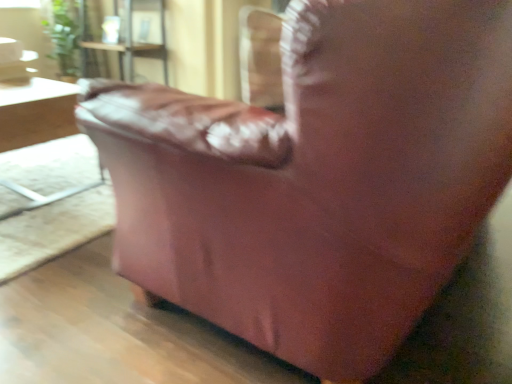
The image size is (512, 384). What do you see at coordinates (36, 112) in the screenshot?
I see `light brown wooden table at left` at bounding box center [36, 112].

Locate an element on the screen. This screenshot has width=512, height=384. light brown wooden table at left is located at coordinates (36, 112).

Describe the element at coordinates (63, 34) in the screenshot. I see `green leafy plant at upper left` at that location.

Measure the distance between point (47, 4) and camera.

They are 3.67 meters apart.

The image size is (512, 384). Find the location of `green leafy plant at upper left`. green leafy plant at upper left is located at coordinates (63, 34).

This screenshot has width=512, height=384. Identify the location of light brown wooden table at left. (36, 112).

Does light brown wooden table at left appear on the left side of green leafy plant at upper left?

No, light brown wooden table at left is not to the left of green leafy plant at upper left.

Between light brown wooden table at left and green leafy plant at upper left, which one is positioned behind?

Positioned behind is green leafy plant at upper left.

Is point (68, 189) positioned in front of point (67, 36)?

Yes, it is.

From the image's perspective, is light brown wooden table at left on green leafy plant at upper left?

No, from the image's perspective, light brown wooden table at left is not above green leafy plant at upper left.

From the picture: From a real-world perspective, is light brown wooden table at left on top of green leafy plant at upper left?

No, from a real-world perspective, light brown wooden table at left is not above green leafy plant at upper left.

Which of these two, light brown wooden table at left or green leafy plant at upper left, is wider?

light brown wooden table at left.

Considering the sizes of light brown wooden table at left and green leafy plant at upper left in the image, is light brown wooden table at left taller or shorter than green leafy plant at upper left?

Clearly, light brown wooden table at left is shorter compared to green leafy plant at upper left.

Can you confirm if light brown wooden table at left is bigger than green leafy plant at upper left?

Correct, light brown wooden table at left is larger in size than green leafy plant at upper left.

Can green leafy plant at upper left be found inside light brown wooden table at left?

No, green leafy plant at upper left is not surrounded by light brown wooden table at left.

Are light brown wooden table at left and green leafy plant at upper left beside each other?

No, light brown wooden table at left is not next to green leafy plant at upper left.

Is light brown wooden table at left turned away from green leafy plant at upper left?

That's not correct — light brown wooden table at left is not looking away from green leafy plant at upper left.

How different are the orientations of light brown wooden table at left and green leafy plant at upper left in degrees?

90.5 degrees separate the facing orientations of light brown wooden table at left and green leafy plant at upper left.

The image size is (512, 384). In order to click on plant behind the light brown wooden table at left in this screenshot , I will do `click(63, 34)`.

Can you confirm if green leafy plant at upper left is positioned to the right of light brown wooden table at left?

In fact, green leafy plant at upper left is to the left of light brown wooden table at left.

Does green leafy plant at upper left lie in front of light brown wooden table at left?

No.

Is point (73, 54) farther from viewer compared to point (41, 134)?

Yes, it is.

From the image's perspective, is green leafy plant at upper left on top of light brown wooden table at left?

Correct, green leafy plant at upper left appears higher than light brown wooden table at left in the image.

Consider the image. From a real-world perspective, is green leafy plant at upper left above or below light brown wooden table at left?

Clearly, from a real-world perspective, green leafy plant at upper left is above light brown wooden table at left.

Which object is wider, green leafy plant at upper left or light brown wooden table at left?

light brown wooden table at left is wider.

Between green leafy plant at upper left and light brown wooden table at left, which one has more height?

green leafy plant at upper left.

Considering the relative sizes of green leafy plant at upper left and light brown wooden table at left in the image provided, is green leafy plant at upper left smaller than light brown wooden table at left?

Yes.

Can we say green leafy plant at upper left lies outside light brown wooden table at left?

Yes, green leafy plant at upper left is not within light brown wooden table at left.

Based on the photo, are green leafy plant at upper left and light brown wooden table at left making contact?

No, green leafy plant at upper left is not making contact with light brown wooden table at left.

Could you tell me if green leafy plant at upper left is turned towards light brown wooden table at left?

No, green leafy plant at upper left is not turned towards light brown wooden table at left.

The image size is (512, 384). Find the location of `table lying below the green leafy plant at upper left (from the image's perspective)`. table lying below the green leafy plant at upper left (from the image's perspective) is located at coordinates (36, 112).

Where is `table below the green leafy plant at upper left (from a real-world perspective)`? Image resolution: width=512 pixels, height=384 pixels. table below the green leafy plant at upper left (from a real-world perspective) is located at coordinates (36, 112).

This screenshot has width=512, height=384. I want to click on plant that is on the left side of light brown wooden table at left, so click(63, 34).